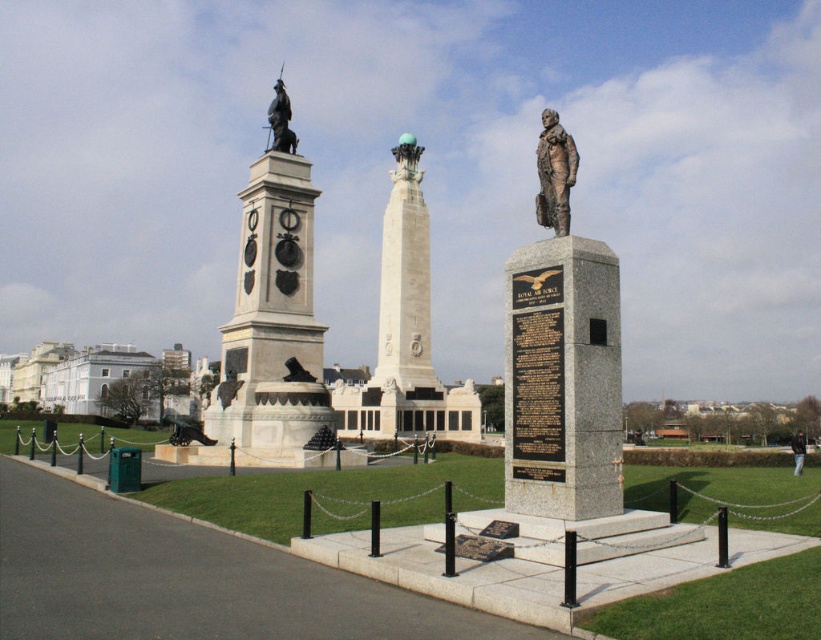
You are a tourist standing in front of the memorial complex. You see the granite monument at center and the bronze statue at upper center. Which one is positioned to the right of the other?

The granite monument at center is positioned to the right of the bronze statue at upper center.

You are a visitor standing at the entrance of the memorial complex. You see the white marble statue at center and the white marble tower at center. If you want to visit both, which one should you go to first to minimize the distance you walk?

The white marble statue at center and white marble tower at center are both at the center, so the distance between them is only 42.35 meters. Since they are close to each other, you can visit either one first without significantly increasing the total distance walked.

You are standing in the memorial complex and want to take a photo that includes both the obelisk and the aviator statue. You notice two points marked in the image at coordinates point (398, 468) and point (281, 115). Which point should you stand closer to ensure both monuments are in frame?

You should stand closer to point (398, 468) because it is closer to the camera than point (281, 115), allowing both monuments to be in frame.